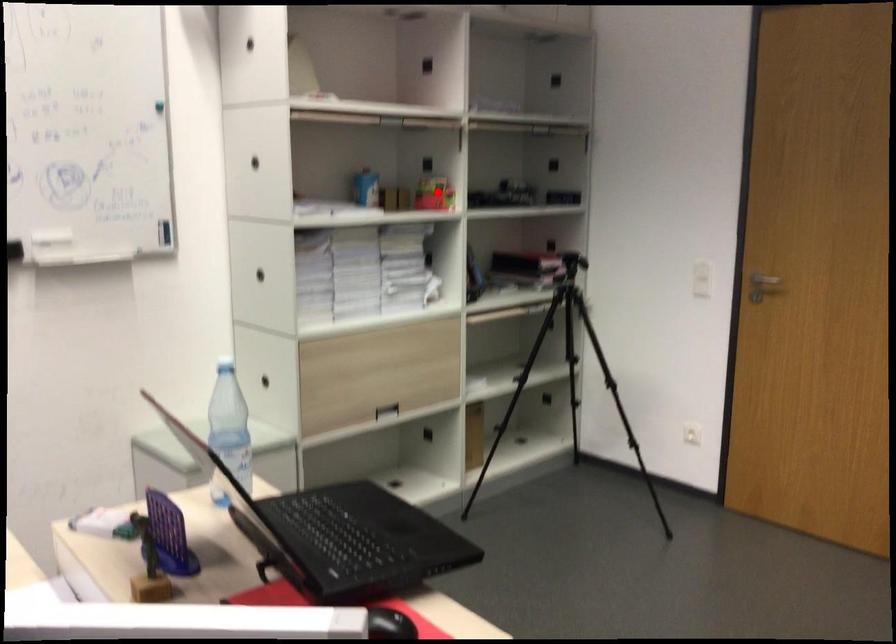
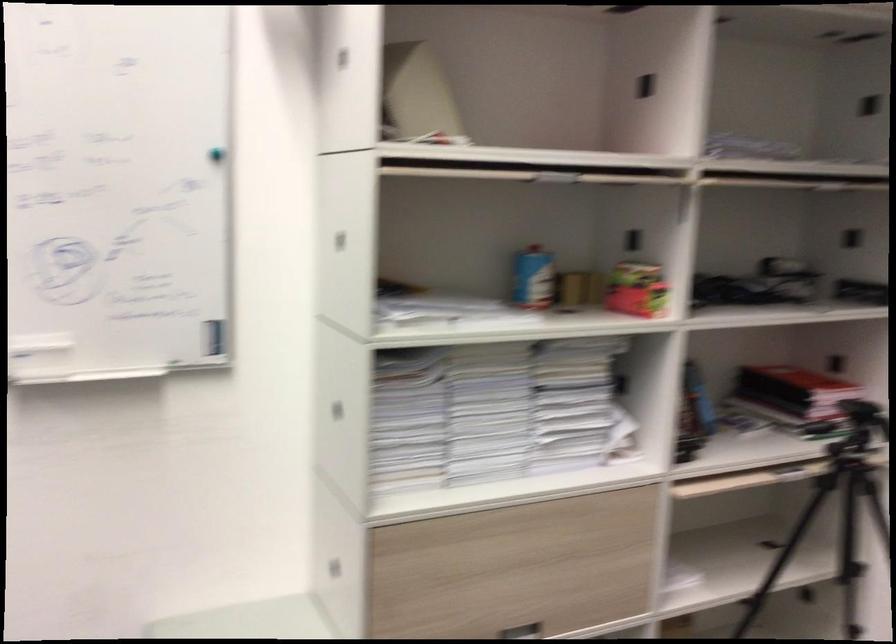
Find the pixel in the second image that matches the highlighted location in the first image.

(636, 289)